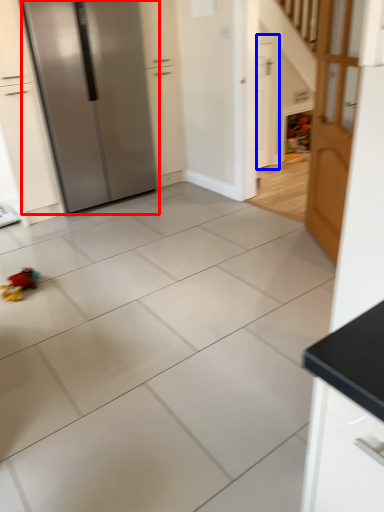
Question: Among these objects, which one is farthest to the camera, refrigerator (highlighted by a red box) or door (highlighted by a blue box)?

Choices:
 (A) refrigerator
 (B) door

Answer: (B)